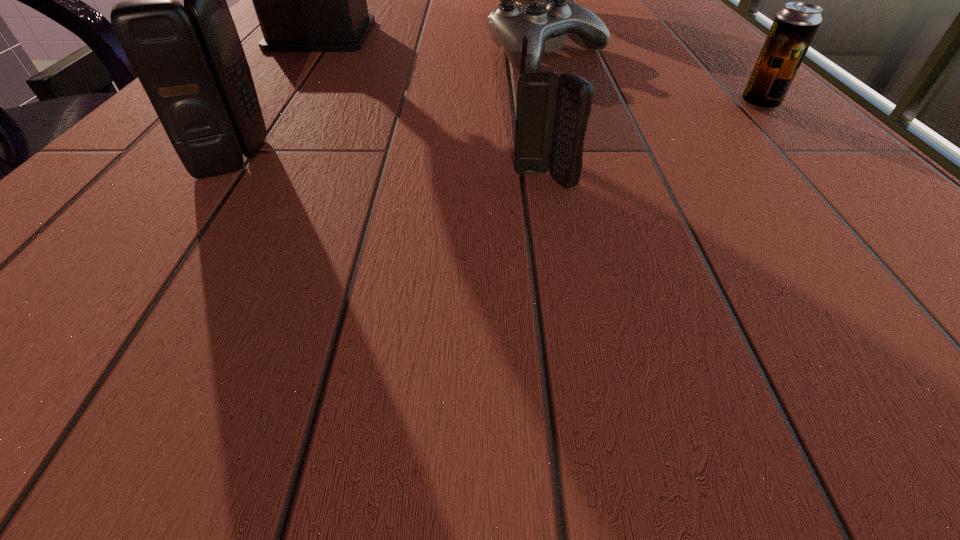
This screenshot has height=540, width=960. Identify the location of the left cellular telephone. (189, 59).

This screenshot has height=540, width=960. In order to click on the taller cellular telephone in this screenshot , I will do `click(189, 59)`.

Locate an element on the screen. Image resolution: width=960 pixels, height=540 pixels. the right cellular telephone is located at coordinates (552, 113).

The height and width of the screenshot is (540, 960). What are the coordinates of `control` in the screenshot? It's located at (546, 21).

The height and width of the screenshot is (540, 960). I want to click on award, so click(307, 0).

Identify the location of the fourth farthest object. (794, 27).

Find the location of a particular element. the rightmost object is located at coordinates (794, 27).

This screenshot has width=960, height=540. I want to click on free location located 0.100m on the keyboard of the second tallest object, so [124, 159].

You are a GUI agent. You are given a task and a screenshot of the screen. Output one action in this format:
    pyautogui.click(x=<x>, y=<y>)
    Task: Click on the free space located on the keyboard of the right cellular telephone
    Image resolution: width=960 pixels, height=540 pixels.
    Given the screenshot: What is the action you would take?
    pyautogui.click(x=552, y=221)

At what (x,y) coordinates should I click in order to perform the action: click on free space located on the back of the control. Please return your answer as a coordinate pair (x, y). Looking at the image, I should click on (534, 4).